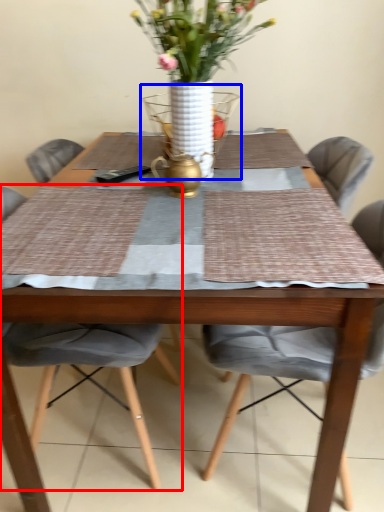
Question: Which object is closer to the camera taking this photo, chair (highlighted by a red box) or glass vase (highlighted by a blue box)?

Choices:
 (A) chair
 (B) glass vase

Answer: (A)